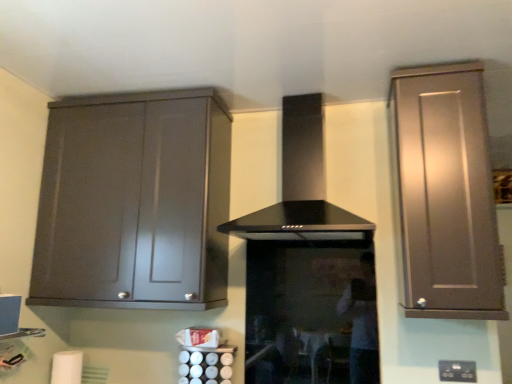
Describe the element at coordinates (457, 371) in the screenshot. The height and width of the screenshot is (384, 512). I see `black plastic electric outlet at lower right` at that location.

Locate an element on the screen. Image resolution: width=512 pixels, height=384 pixels. black plastic electric outlet at lower right is located at coordinates (457, 371).

Measure the distance between point (187, 369) and camera.

1.93 meters.

This screenshot has width=512, height=384. What are the coordinates of `satin brown cabinet at right, placed as the 2th cabinetry when sorted from left to right` in the screenshot? It's located at (444, 193).

Based on the photo, in terms of size, does matte gray cabinet at left, the first cabinetry when ordered from left to right, appear bigger or smaller than black plastic electric outlet at lower right?

Considering their sizes, matte gray cabinet at left, the first cabinetry when ordered from left to right, takes up more space than black plastic electric outlet at lower right.

Looking at this image, from a real-world perspective, between matte gray cabinet at left, the first cabinetry when ordered from left to right, and black plastic electric outlet at lower right, who is vertically lower?

From a 3D spatial view, black plastic electric outlet at lower right is below.

Would you say matte gray cabinet at left, the 2th cabinetry when ordered from right to left, is outside black plastic electric outlet at lower right?

Indeed, matte gray cabinet at left, the 2th cabinetry when ordered from right to left, is completely outside black plastic electric outlet at lower right.

Is point (129, 300) less distant than point (457, 374)?

No.

Where is `home appliance above the white matte toilet paper at lower left (from the image's perspective)`? home appliance above the white matte toilet paper at lower left (from the image's perspective) is located at coordinates (301, 186).

Is point (59, 375) positioned behind point (319, 234)?

Yes, point (59, 375) is behind point (319, 234).

Is white matte toilet paper at lower left bigger or smaller than black glass range hood at center?

Considering their sizes, white matte toilet paper at lower left takes up less space than black glass range hood at center.

Consider the image. In the image, is white matte toilet paper at lower left on the left side or the right side of black glass range hood at center?

white matte toilet paper at lower left is to the left of black glass range hood at center.

Can you confirm if white matte toilet paper at lower left is thinner than satin brown cabinet at right, placed as the 2th cabinetry when sorted from left to right?

Yes.

Does white matte toilet paper at lower left appear on the left side of satin brown cabinet at right, which is the 1th cabinetry in right-to-left order?

Yes.

Is white matte toilet paper at lower left bigger or smaller than satin brown cabinet at right, placed as the 2th cabinetry when sorted from left to right?

white matte toilet paper at lower left is smaller than satin brown cabinet at right, placed as the 2th cabinetry when sorted from left to right.

Relative to satin brown cabinet at right, which is the 1th cabinetry in right-to-left order, is white matte toilet paper at lower left in front or behind?

white matte toilet paper at lower left is behind satin brown cabinet at right, which is the 1th cabinetry in right-to-left order.

How far apart are satin brown cabinet at right, placed as the 2th cabinetry when sorted from left to right, and satin silver canisters at lower center?

satin brown cabinet at right, placed as the 2th cabinetry when sorted from left to right, and satin silver canisters at lower center are 3.63 feet apart from each other.

Which is in front, point (452, 254) or point (202, 353)?

The point (452, 254) is in front.

Considering the relative sizes of satin brown cabinet at right, placed as the 2th cabinetry when sorted from left to right, and satin silver canisters at lower center in the image provided, is satin brown cabinet at right, placed as the 2th cabinetry when sorted from left to right, thinner than satin silver canisters at lower center?

No, satin brown cabinet at right, placed as the 2th cabinetry when sorted from left to right, is not thinner than satin silver canisters at lower center.

Is satin brown cabinet at right, which is the 1th cabinetry in right-to-left order, located outside satin silver canisters at lower center?

Yes.

Is matte gray cabinet at left, the first cabinetry when ordered from left to right, aimed at black glass range hood at center?

No, matte gray cabinet at left, the first cabinetry when ordered from left to right, is not aimed at black glass range hood at center.

Can you tell me how much matte gray cabinet at left, the first cabinetry when ordered from left to right, and black glass range hood at center differ in facing direction?

The angular difference between matte gray cabinet at left, the first cabinetry when ordered from left to right, and black glass range hood at center is 2.17 degrees.

Is black glass range hood at center inside matte gray cabinet at left, the 2th cabinetry when ordered from right to left?

No, matte gray cabinet at left, the 2th cabinetry when ordered from right to left, does not contain black glass range hood at center.

From a real-world perspective, is matte gray cabinet at left, the first cabinetry when ordered from left to right, on black glass range hood at center?

No, from a real-world perspective, matte gray cabinet at left, the first cabinetry when ordered from left to right, is not over black glass range hood at center

Can you confirm if satin silver canisters at lower center is shorter than black plastic electric outlet at lower right?

No.

From the image's perspective, is satin silver canisters at lower center on top of black plastic electric outlet at lower right?

Incorrect, from the image's perspective, satin silver canisters at lower center is lower than black plastic electric outlet at lower right.

Is satin silver canisters at lower center closer to the viewer compared to black plastic electric outlet at lower right?

No.

Can you tell me how much satin silver canisters at lower center and black plastic electric outlet at lower right differ in facing direction?

satin silver canisters at lower center and black plastic electric outlet at lower right are facing 0.984 degrees away from each other.

Does matte gray cabinet at left, the first cabinetry when ordered from left to right, have a greater width compared to satin brown cabinet at right, placed as the 2th cabinetry when sorted from left to right?

No.

Is matte gray cabinet at left, the 2th cabinetry when ordered from right to left, far away from satin brown cabinet at right, placed as the 2th cabinetry when sorted from left to right?

matte gray cabinet at left, the 2th cabinetry when ordered from right to left, is positioned a significant distance from satin brown cabinet at right, placed as the 2th cabinetry when sorted from left to right.

Which is closer, (187, 287) or (485, 211)?

Point (187, 287) is positioned farther from the camera compared to point (485, 211).

Where is `cabinetry that is the 1st object above the black plastic electric outlet at lower right (from a real-world perspective)`? The width and height of the screenshot is (512, 384). cabinetry that is the 1st object above the black plastic electric outlet at lower right (from a real-world perspective) is located at coordinates (134, 202).

This screenshot has width=512, height=384. I want to click on home appliance in front of the white matte toilet paper at lower left, so pos(301,186).

Looking at the image, which one is located closer to black glass range hood at center, satin brown cabinet at right, placed as the 2th cabinetry when sorted from left to right, or matte gray cabinet at left, the 2th cabinetry when ordered from right to left?

The object closer to black glass range hood at center is satin brown cabinet at right, placed as the 2th cabinetry when sorted from left to right.

Looking at the image, which one is located further to satin brown cabinet at right, placed as the 2th cabinetry when sorted from left to right, satin silver canisters at lower center or matte gray cabinet at left, the 2th cabinetry when ordered from right to left?

satin silver canisters at lower center.

When comparing their distances from black plastic electric outlet at lower right, does matte gray cabinet at left, the 2th cabinetry when ordered from right to left, or white matte toilet paper at lower left seem closer?

matte gray cabinet at left, the 2th cabinetry when ordered from right to left, is closer to black plastic electric outlet at lower right.

Estimate the real-world distances between objects in this image. Which object is closer to matte gray cabinet at left, the 2th cabinetry when ordered from right to left, satin silver canisters at lower center or black plastic electric outlet at lower right?

satin silver canisters at lower center.

Looking at the image, which one is located further to white matte toilet paper at lower left, black glass range hood at center or satin silver canisters at lower center?

black glass range hood at center lies further to white matte toilet paper at lower left than the other object.

Considering their positions, is satin silver canisters at lower center positioned further to black plastic electric outlet at lower right than black glass range hood at center?

satin silver canisters at lower center is positioned further to the anchor black plastic electric outlet at lower right.

Considering their positions, is white matte toilet paper at lower left positioned closer to black plastic electric outlet at lower right than matte gray cabinet at left, the 2th cabinetry when ordered from right to left?

matte gray cabinet at left, the 2th cabinetry when ordered from right to left, is closer to black plastic electric outlet at lower right.

Consider the image. Considering their positions, is satin brown cabinet at right, which is the 1th cabinetry in right-to-left order, positioned closer to matte gray cabinet at left, the first cabinetry when ordered from left to right, than black glass range hood at center?

black glass range hood at center lies closer to matte gray cabinet at left, the first cabinetry when ordered from left to right, than the other object.

The width and height of the screenshot is (512, 384). What are the coordinates of `home appliance between white matte toilet paper at lower left and satin brown cabinet at right, placed as the 2th cabinetry when sorted from left to right, from left to right` in the screenshot? It's located at (301, 186).

Find the location of a particular element. cabinetry between white matte toilet paper at lower left and satin brown cabinet at right, which is the 1th cabinetry in right-to-left order is located at coordinates (134, 202).

The height and width of the screenshot is (384, 512). Find the location of `cabinetry between matte gray cabinet at left, the 2th cabinetry when ordered from right to left, and black plastic electric outlet at lower right`. cabinetry between matte gray cabinet at left, the 2th cabinetry when ordered from right to left, and black plastic electric outlet at lower right is located at coordinates (444, 193).

This screenshot has width=512, height=384. Identify the location of appliance between white matte toilet paper at lower left and black plastic electric outlet at lower right from left to right. (206, 365).